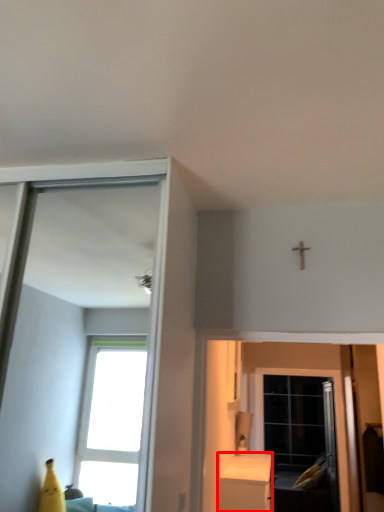
Question: From the image's perspective, considering the relative positions of furniture (annotated by the red box) and screen door in the image provided, where is furniture (annotated by the red box) located with respect to the staircase?

Choices:
 (A) above
 (B) below

Answer: (A)